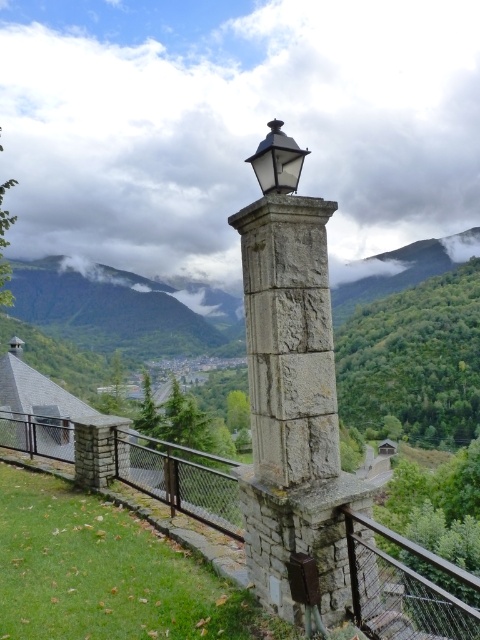
Question: Which object is closer to the camera taking this photo?

Choices:
 (A) rusty metal fence at center
 (B) matte black lantern at upper center

Answer: (A)

Question: Which point is closer to the camera?

Choices:
 (A) (422, 621)
 (B) (283, 180)

Answer: (A)

Question: Can you confirm if rusty metal fence at center is positioned to the right of matte black lantern at upper center?

Choices:
 (A) no
 (B) yes

Answer: (A)

Question: Is rusty metal fence at center positioned at the back of matte black lantern at upper center?

Choices:
 (A) yes
 (B) no

Answer: (B)

Question: Is rusty metal fence at center above matte black lantern at upper center?

Choices:
 (A) no
 (B) yes

Answer: (A)

Question: Which of the following is the closest to the observer?

Choices:
 (A) matte black lantern at upper center
 (B) rusty metal fence at center

Answer: (B)